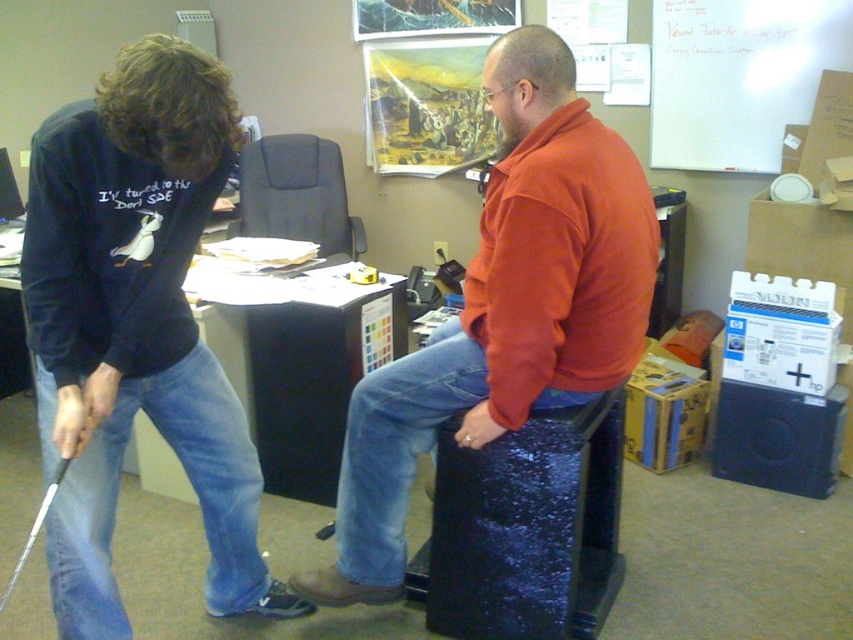
You are organizing a golf practice session in the office. You have a matte black golf club at left and a shiny blue stool at center. Which object has a smaller width?

The matte black golf club at left has a smaller width than the shiny blue stool at center.